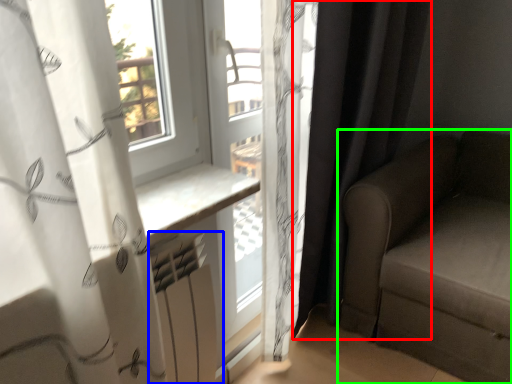
Question: Which is nearer to the curtain (highlighted by a red box)? radiator (highlighted by a blue box) or studio couch (highlighted by a green box).

Choices:
 (A) radiator
 (B) studio couch

Answer: (B)